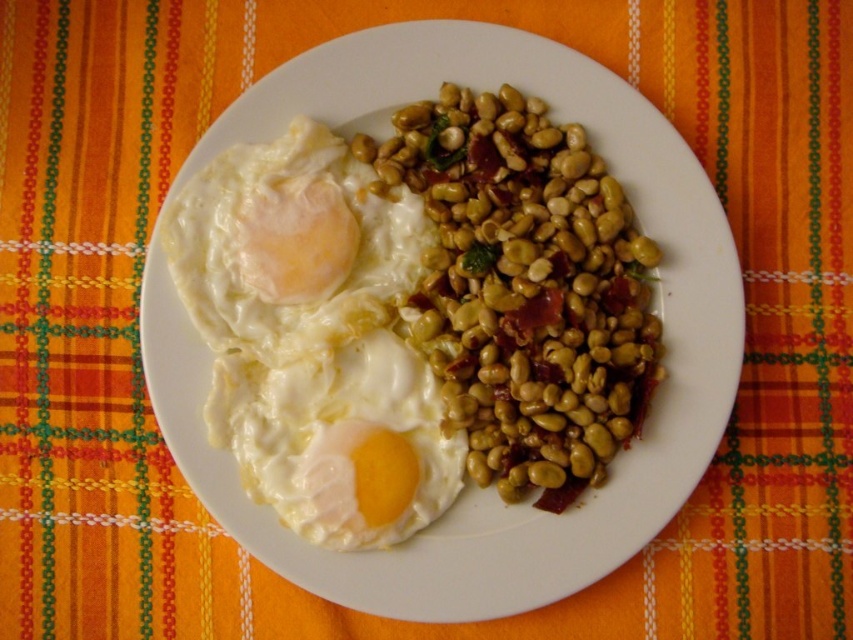
Who is taller, green matte beans at center or white creamy egg at center?

Standing taller between the two is green matte beans at center.

Which is more to the left, green matte beans at center or white creamy egg at center?

From the viewer's perspective, white creamy egg at center appears more on the left side.

Is point (425, 161) behind point (355, 538)?

That is True.

Image resolution: width=853 pixels, height=640 pixels. I want to click on green matte beans at center, so click(524, 289).

Can you confirm if green matte beans at center is thinner than white matte fried egg at upper left?

No, green matte beans at center is not thinner than white matte fried egg at upper left.

Is green matte beans at center bigger than white matte fried egg at upper left?

Yes.

Is point (447, 312) farther from camera compared to point (407, 252)?

No, (447, 312) is in front of (407, 252).

This screenshot has width=853, height=640. What are the coordinates of `green matte beans at center` in the screenshot? It's located at (524, 289).

Does white matte fried egg at upper left have a greater height compared to white creamy egg at center?

Yes, white matte fried egg at upper left is taller than white creamy egg at center.

Is white matte fried egg at upper left further to the viewer compared to white creamy egg at center?

No, white matte fried egg at upper left is closer to the viewer.

Find the location of a particular element. This screenshot has height=640, width=853. white matte fried egg at upper left is located at coordinates (289, 246).